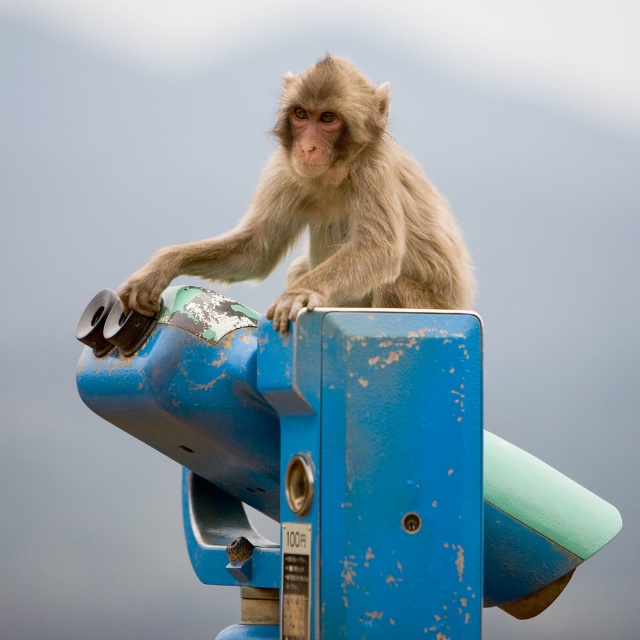
Question: Which point is farther to the camera?

Choices:
 (A) (196, 410)
 (B) (349, 243)

Answer: (B)

Question: Is blue matte/rough telescope at upper center further to camera compared to fuzzy beige monkey at center?

Choices:
 (A) no
 (B) yes

Answer: (A)

Question: Is blue matte/rough telescope at upper center positioned before fuzzy beige monkey at center?

Choices:
 (A) no
 (B) yes

Answer: (B)

Question: Which point is farther to the camera?

Choices:
 (A) (342, 360)
 (B) (374, 138)

Answer: (B)

Question: Which of the following is the closest to the observer?

Choices:
 (A) (346, 497)
 (B) (298, 298)

Answer: (A)

Question: Can you confirm if blue matte/rough telescope at upper center is positioned above fuzzy beige monkey at center?

Choices:
 (A) no
 (B) yes

Answer: (A)